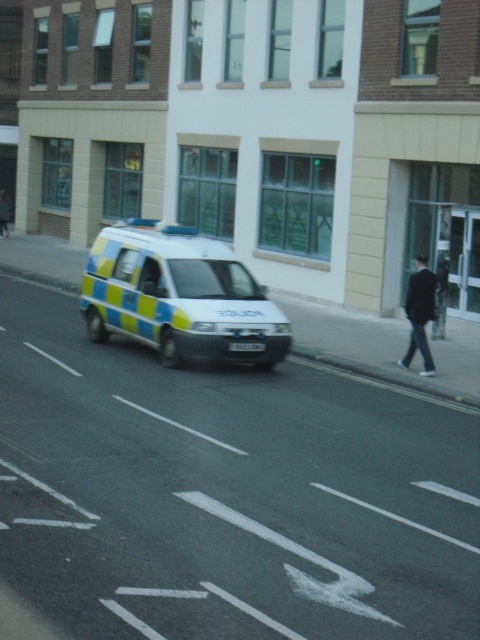
Question: Which point is closer to the camera taking this photo?

Choices:
 (A) (398, 364)
 (B) (222, 321)

Answer: (B)

Question: Is blue and yellow painted van at center further to camera compared to dark blue fabric jacket at right?

Choices:
 (A) yes
 (B) no

Answer: (B)

Question: Which object appears farthest from the camera in this image?

Choices:
 (A) blue and yellow painted van at center
 (B) dark blue fabric jacket at right

Answer: (B)

Question: Does blue and yellow painted van at center have a lesser width compared to dark blue fabric jacket at right?

Choices:
 (A) no
 (B) yes

Answer: (B)

Question: Does blue and yellow painted van at center have a greater width compared to dark blue fabric jacket at right?

Choices:
 (A) no
 (B) yes

Answer: (A)